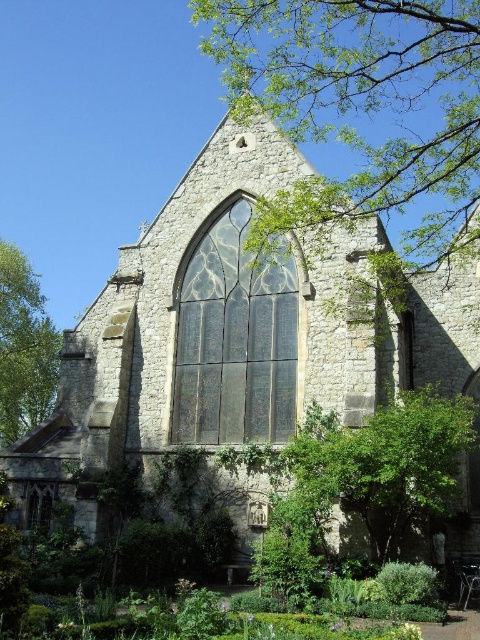
You are standing in front of the historic stone church and notice two green leafy trees. One is labeled as the green leafy tree at upper center and the other as the green leafy tree at left. Which tree is located more to the left side of the church?

The green leafy tree at left is positioned more to the left side of the church than the green leafy tree at upper center.